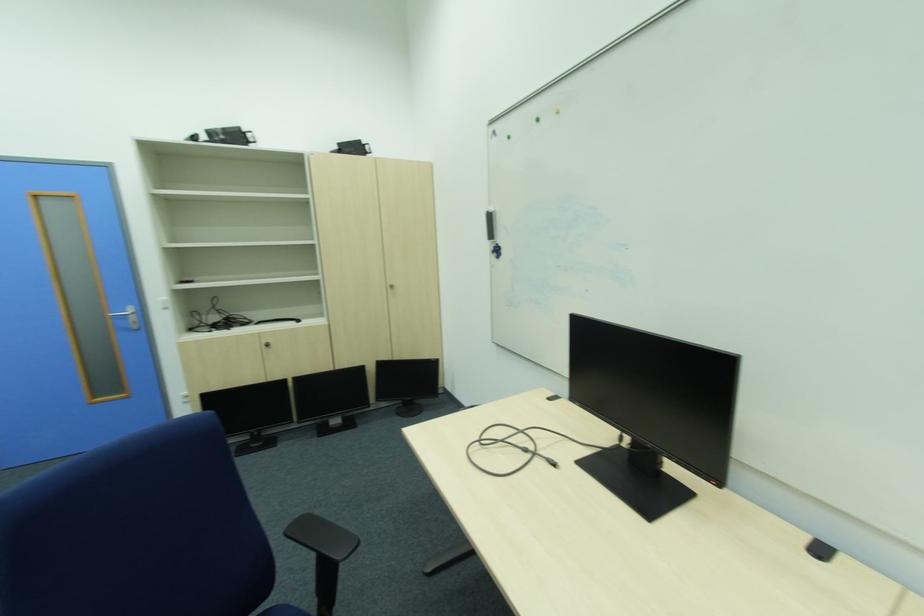
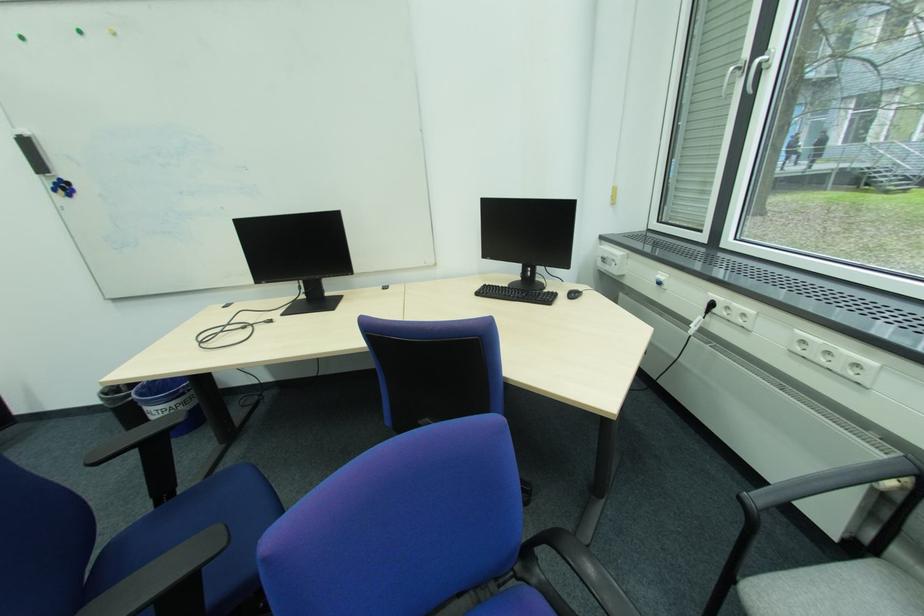
The point at [503,248] is marked in the first image. Where is the corresponding point in the second image?

(62, 185)